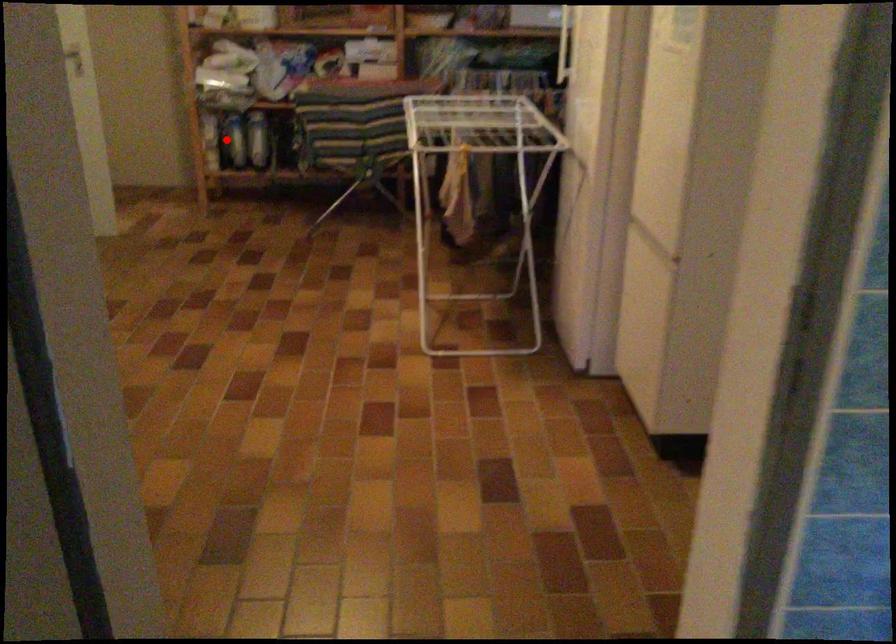
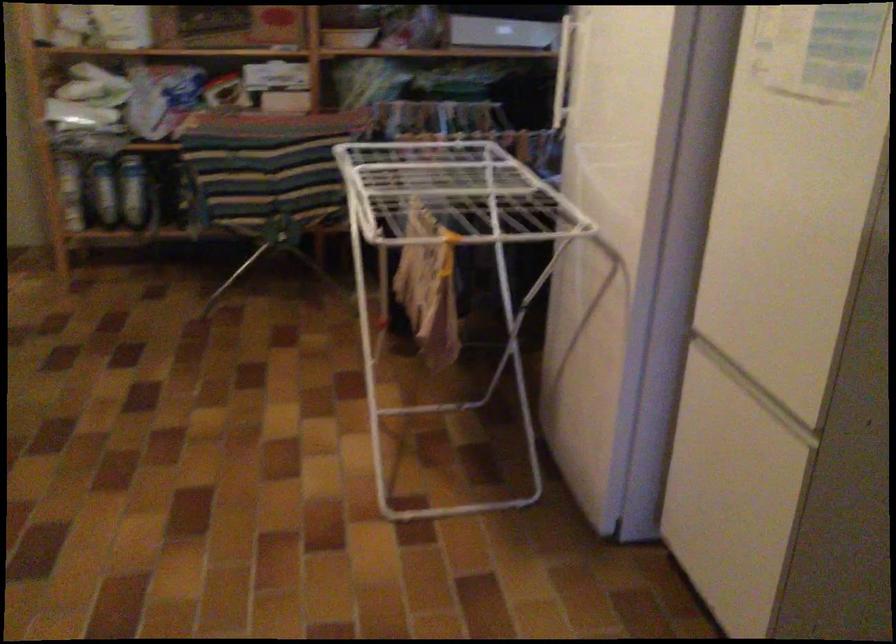
Question: I am providing you with two images of the same scene from different viewpoints. Given a red point in image1, look at the same physical point in image2. Is it:

Choices:
 (A) Closer to the viewpoint
 (B) Farther from the viewpoint

Answer: (A)